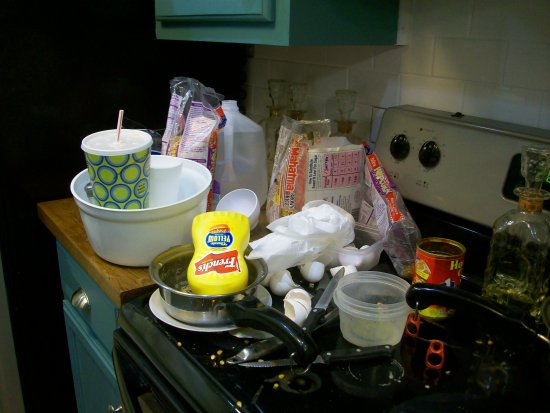
This screenshot has height=413, width=550. I want to click on green cabinet mounted to wall, so click(252, 18).